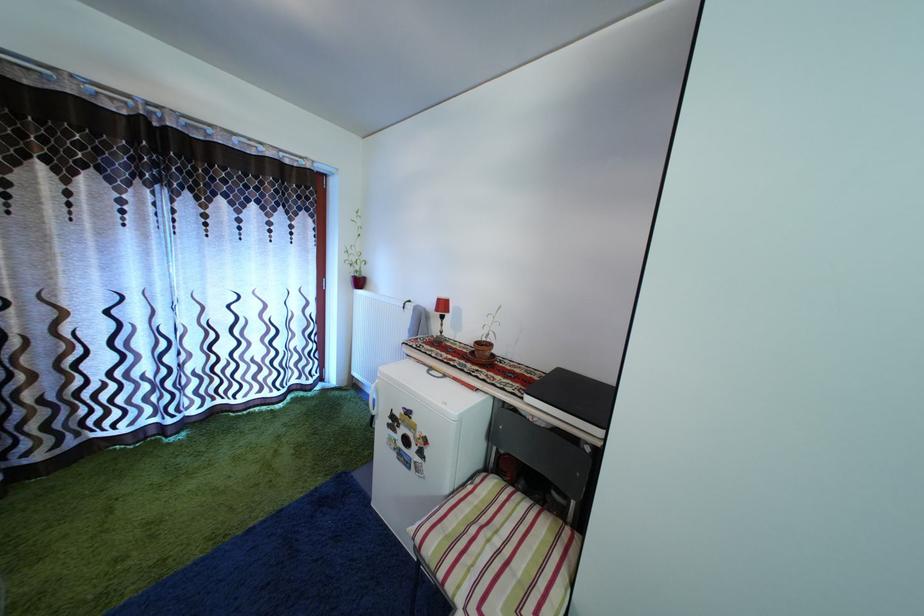
Find where to lift the red table lamp. Please return your answer as a coordinate pair (x, y).

(442, 310)